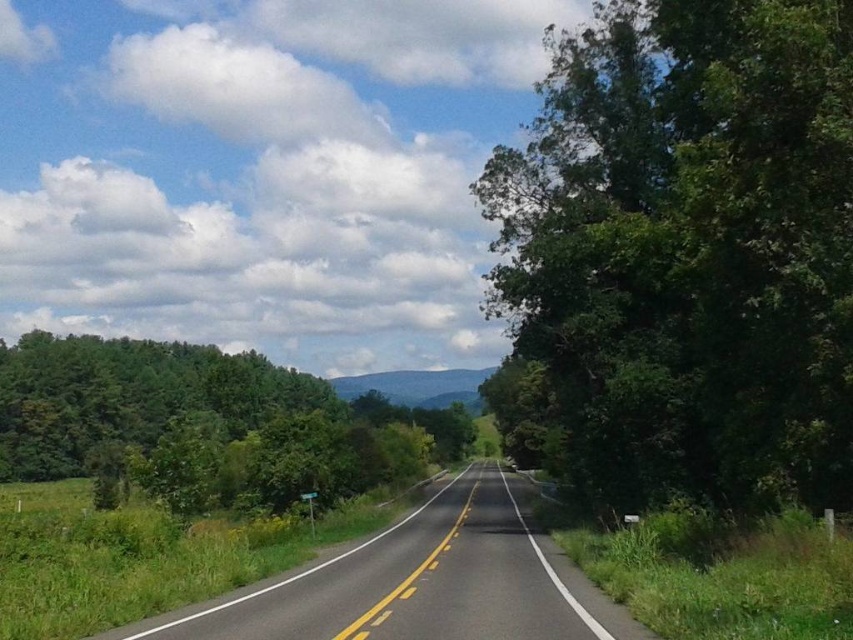
Is point (792, 394) in front of point (10, 420)?

That is True.

Is point (711, 296) more distant than point (339, 492)?

No, (711, 296) is closer to viewer.

The width and height of the screenshot is (853, 640). I want to click on green leafy tree at right, so click(689, 250).

Which of these two, green leafy tree at left or asphalt road at center, stands shorter?

Standing shorter between the two is asphalt road at center.

Does green leafy tree at left have a larger size compared to asphalt road at center?

Yes.

The height and width of the screenshot is (640, 853). I want to click on green leafy tree at left, so (x=198, y=420).

Is green leafy tree at right thinner than asphalt road at center?

Correct, green leafy tree at right's width is less than asphalt road at center's.

Locate an element on the screen. Image resolution: width=853 pixels, height=640 pixels. green leafy tree at right is located at coordinates pos(689,250).

Where is `green leafy tree at right`? green leafy tree at right is located at coordinates (689, 250).